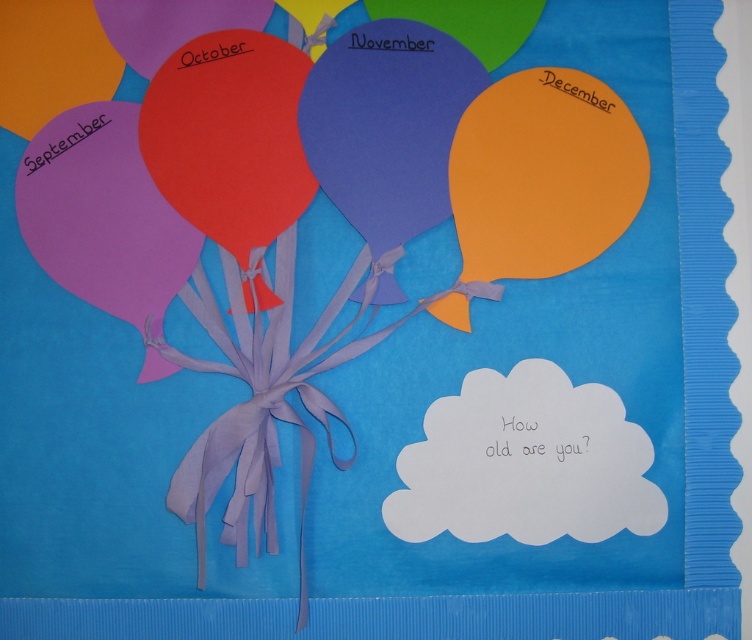
Is orange paper balloon at upper right below purple paper at left?

Correct, orange paper balloon at upper right is located below purple paper at left.

Does orange paper balloon at upper right come in front of purple paper at left?

No, it is not.

Does point (519, 180) come farther from viewer compared to point (71, 144)?

Yes, point (519, 180) is behind point (71, 144).

This screenshot has width=752, height=640. I want to click on orange paper balloon at upper right, so click(543, 173).

Can you confirm if purple paper balloon at left is thinner than matte orange balloon at upper center?

No.

Consider the image. Can you confirm if purple paper balloon at left is bigger than matte orange balloon at upper center?

Yes.

The height and width of the screenshot is (640, 752). Describe the element at coordinates (102, 212) in the screenshot. I see `purple paper balloon at left` at that location.

You are a GUI agent. You are given a task and a screenshot of the screen. Output one action in this format:
    pyautogui.click(x=<x>, y=<y>)
    Task: Click on the purple paper balloon at left
    Image resolution: width=752 pixels, height=640 pixels.
    Given the screenshot: What is the action you would take?
    pyautogui.click(x=102, y=212)

What do you see at coordinates (543, 173) in the screenshot?
I see `orange paper balloon at upper right` at bounding box center [543, 173].

Is point (505, 163) farther from viewer compared to point (29, 173)?

Yes.

Which is in front, point (596, 188) or point (126, 204)?

Point (126, 204) is in front.

The width and height of the screenshot is (752, 640). What are the coordinates of `orange paper balloon at upper right` in the screenshot? It's located at (543, 173).